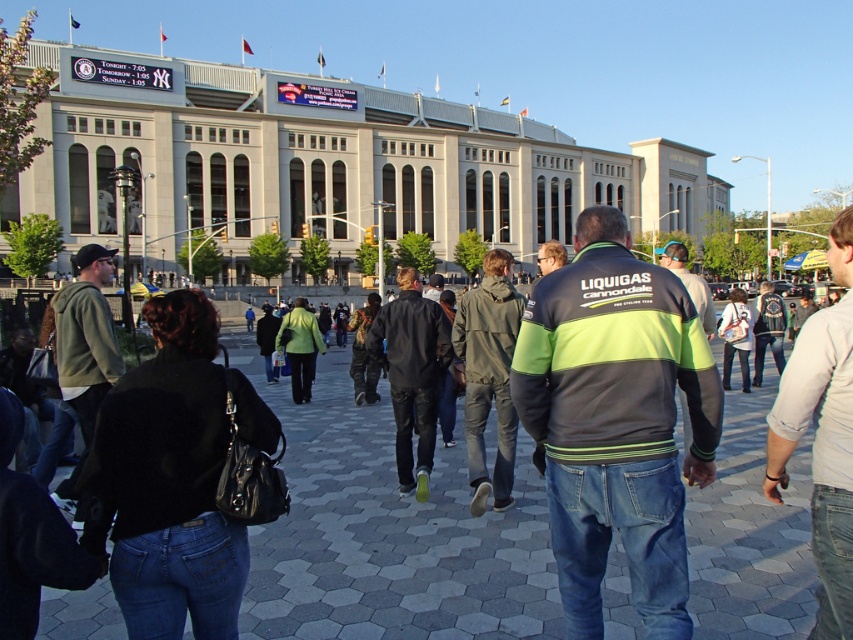
Question: Which point appears farthest from the camera in this image?

Choices:
 (A) (442, 458)
 (B) (432, 440)
 (C) (67, 328)
 (D) (606, 237)

Answer: (A)

Question: Which object is farther from the camera taking this photo?

Choices:
 (A) green and gray jacket at center
 (B) green fleece jacket at left

Answer: (B)

Question: Is gray hexagonal paving at center smaller than green fleece jacket at left?

Choices:
 (A) no
 (B) yes

Answer: (A)

Question: Which object is farther from the camera taking this photo?

Choices:
 (A) white cotton shirt at right
 (B) dark green jacket at center
 (C) green reflective jacket at center

Answer: (B)

Question: Can you confirm if green fleece jacket at left is positioned to the left of green reflective jacket at center?

Choices:
 (A) no
 (B) yes

Answer: (B)

Question: Is white cotton shirt at right to the left of green fleece jacket at left from the viewer's perspective?

Choices:
 (A) no
 (B) yes

Answer: (A)